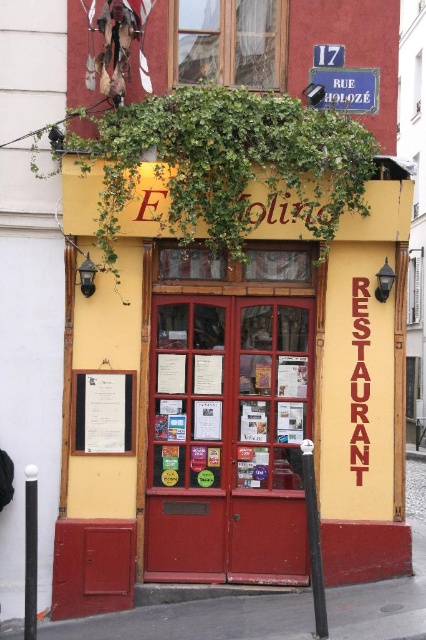
Consider the image. You are a customer standing outside the restaurant and want to read the white paper menu at center. However, the green leafy ivy at upper center is blocking your view. Can you tell me which object is higher and might be causing the obstruction?

The green leafy ivy at upper center is taller than the white paper menu at center, so it is the higher object and is likely causing the obstruction.

You are standing at the point labeled point [359,166]. The restaurant entrance is 7.02 meters away from you. If you want to enter the restaurant, in which direction should you walk relative to your current position?

You should walk towards the restaurant entrance, which is 7.02 meters away from the point labeled point [359,166]. Since the entrance is the main access point, walking in that direction will lead you inside.

You are a customer standing outside the restaurant and want to read the white paper menu at center. However, the green leafy ivy at upper center is blocking your view. Which direction should you move to get a better view of the menu?

The green leafy ivy at upper center is to the right of the white paper menu at center. To avoid the ivy blocking your view, you should move to the left side of the entrance where the ivy is not obscuring the menu.